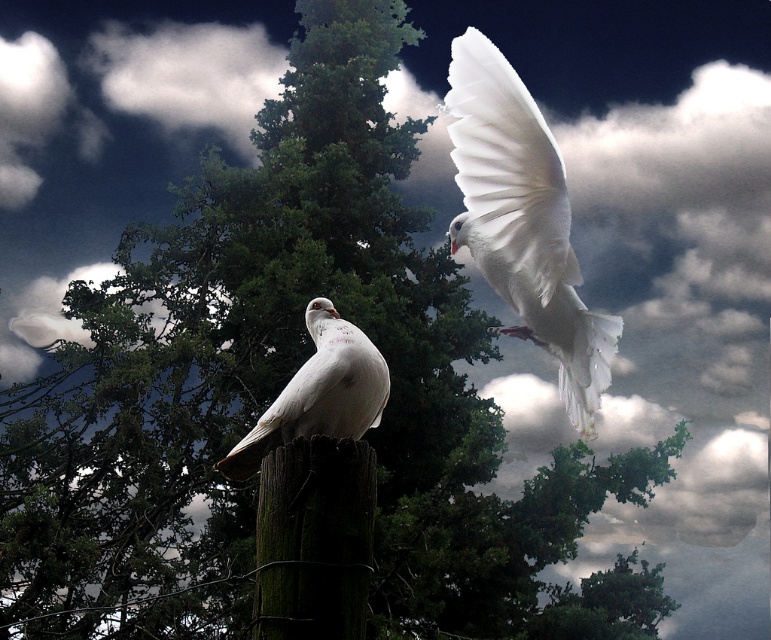
Can you confirm if white feathered dove at upper right is positioned to the left of white matte dove at center?

In fact, white feathered dove at upper right is to the right of white matte dove at center.

Does white feathered dove at upper right have a lesser height compared to white matte dove at center?

In fact, white feathered dove at upper right may be taller than white matte dove at center.

Does point (598, 317) lie in front of point (298, 406)?

Yes.

At what (x,y) coordinates should I click in order to perform the action: click on white feathered dove at upper right. Please return your answer as a coordinate pair (x, y). Looking at the image, I should click on (524, 220).

Does white feathered dove at upper right appear over green mossy wood at center?

Yes, white feathered dove at upper right is above green mossy wood at center.

Does white feathered dove at upper right have a lesser width compared to green mossy wood at center?

No.

At what (x,y) coordinates should I click in order to perform the action: click on white feathered dove at upper right. Please return your answer as a coordinate pair (x, y). The image size is (771, 640). Looking at the image, I should click on (524, 220).

Does green mossy wood at center appear on the right side of white matte dove at center?

Indeed, green mossy wood at center is positioned on the right side of white matte dove at center.

Does green mossy wood at center have a lesser height compared to white matte dove at center?

Yes.

Who is more distant from viewer, (275, 586) or (335, 406)?

Positioned behind is point (335, 406).

At what (x,y) coordinates should I click in order to perform the action: click on green mossy wood at center. Please return your answer as a coordinate pair (x, y). Looking at the image, I should click on (315, 540).